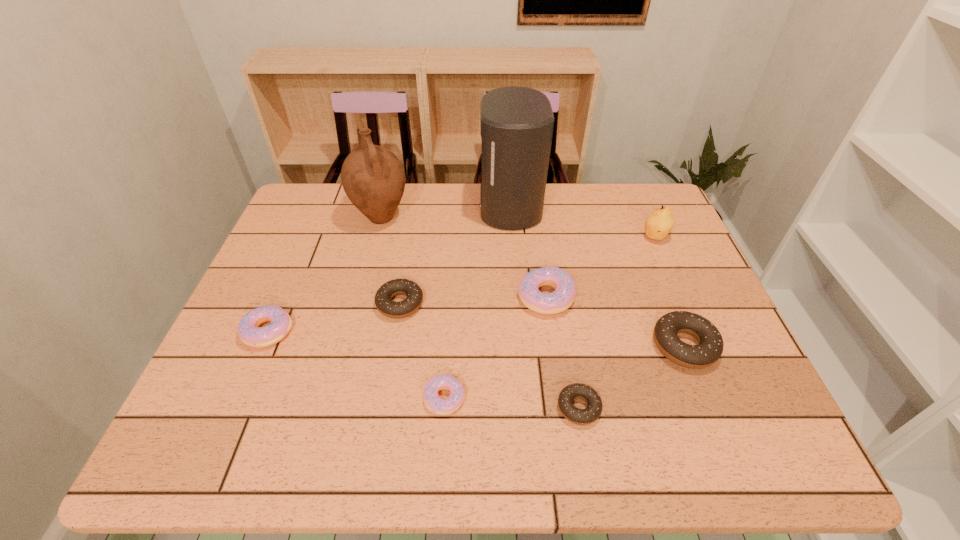
What are the coordinates of `object located in the left edge section of the desktop` in the screenshot? It's located at point(250,333).

Locate an element on the screen. This screenshot has height=540, width=960. pear that is at the right edge is located at coordinates (659, 223).

Where is `doughnut at the right edge`? This screenshot has height=540, width=960. doughnut at the right edge is located at coordinates (710, 345).

Identify the location of object present at the far right corner. This screenshot has width=960, height=540. (659, 223).

Where is `free region at the far edge`? Image resolution: width=960 pixels, height=540 pixels. free region at the far edge is located at coordinates tap(588, 195).

Find the location of a particular element. vacant position at the near edge of the desktop is located at coordinates (484, 427).

The width and height of the screenshot is (960, 540). I want to click on vacant position at the right edge of the desktop, so click(x=709, y=417).

The width and height of the screenshot is (960, 540). Find the location of `vacant region at the far left corner`. vacant region at the far left corner is located at coordinates (325, 196).

You are a GUI agent. You are given a task and a screenshot of the screen. Output one action in this format:
    pyautogui.click(x=<x>, y=<y>)
    Task: Click on the vacant space at the far right corner of the desktop
    Image resolution: width=960 pixels, height=540 pixels.
    Given the screenshot: What is the action you would take?
    [x=655, y=188]

Locate an element on the screen. This screenshot has width=960, height=540. vacant area that lies between the second pink doughnut from left to right and the pear is located at coordinates (549, 318).